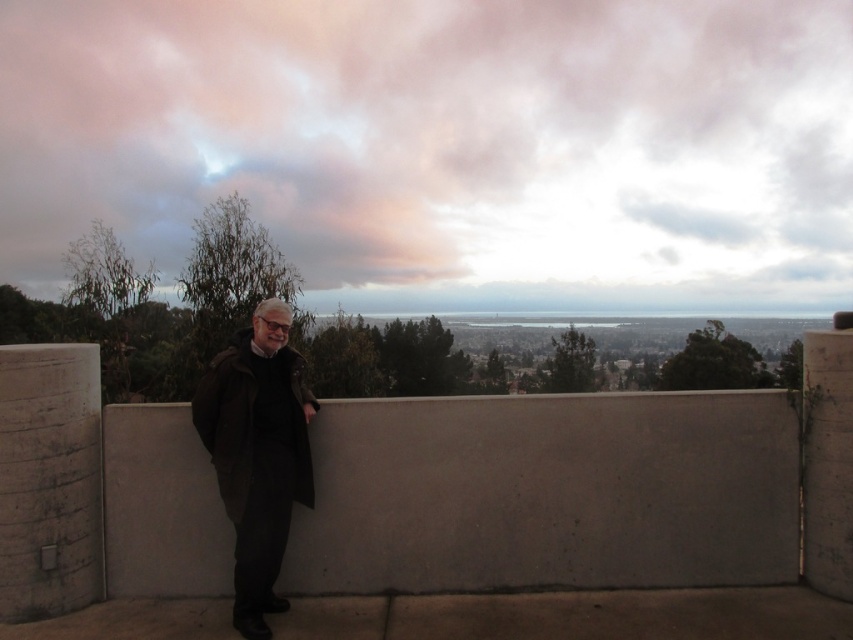
Looking at this image, you are a painter who wants to capture the scene accurately. You notice the pink fluffy cloud at upper center and the dark brown leather coat at center. Which object is positioned to the right of the other?

The pink fluffy cloud at upper center is to the right of the dark brown leather coat at center.

You are standing at the camera position and want to place a small potted plant on the gray concrete ledge at center. If the potted plant requires 1 foot of space in front of it to grow properly, will there be enough space between you and the ledge?

The gray concrete ledge at center is 14.84 feet away from camera. Subtracting the 1 foot needed for the plant, there is still 13.84 feet of space between you and the ledge, which is more than enough.

You are a bird looking for a place to land. You see the pink fluffy cloud at upper center and the gray concrete ledge at center. Which one is closer to you?

The pink fluffy cloud at upper center is closer to you because the gray concrete ledge at center is behind it.